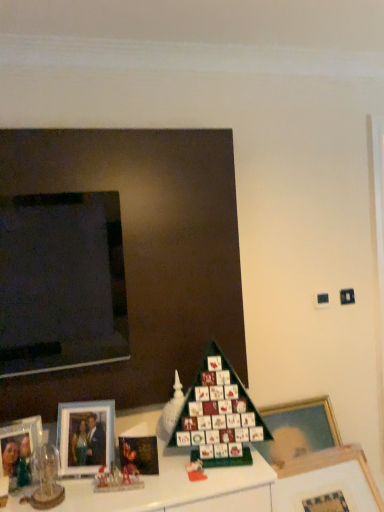
In order to click on free spot to the right of matte black picture frame at lower left, acting as the 2th picture frame starting from the right in this screenshot , I will do `click(180, 468)`.